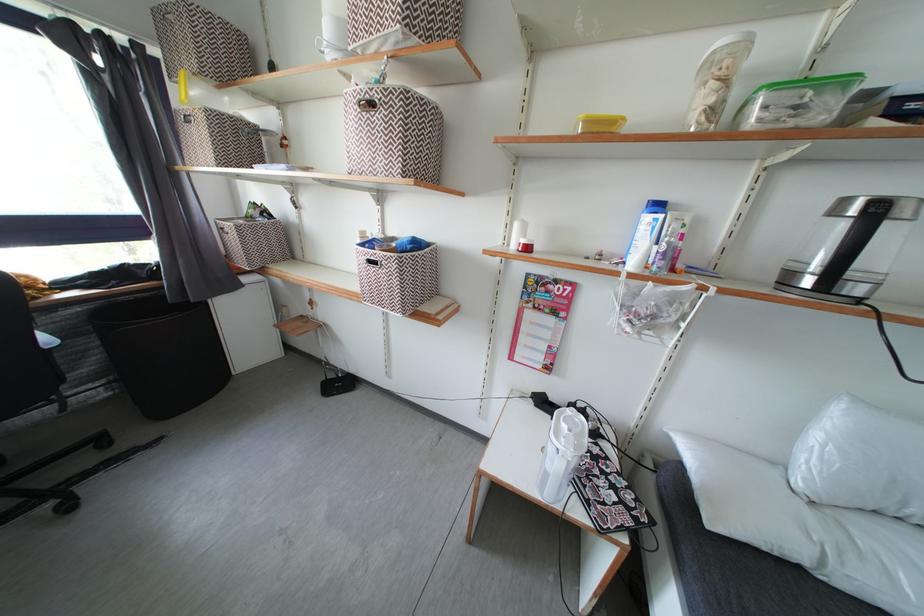
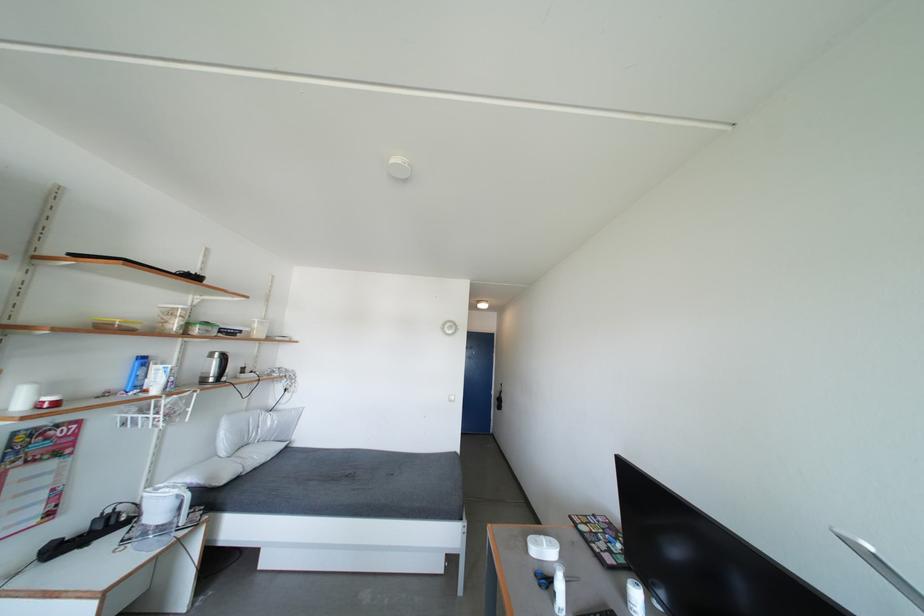
Find the pixel in the second image that matches the point at 796,100 in the first image.

(212, 333)